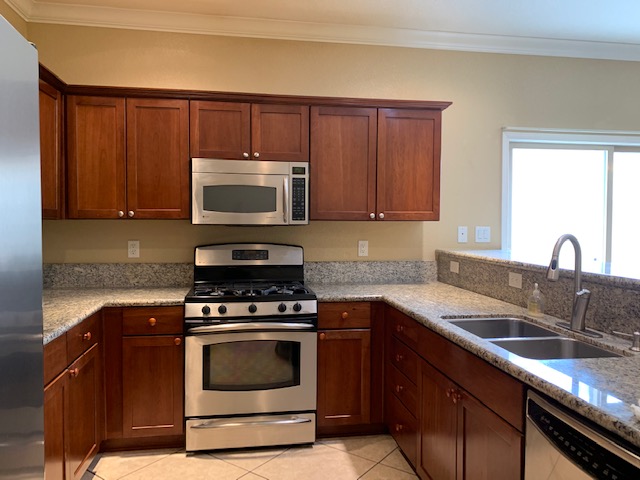
Find the location of `wall`. wall is located at coordinates (242, 62), (527, 77), (472, 176), (76, 245), (402, 238), (620, 80).